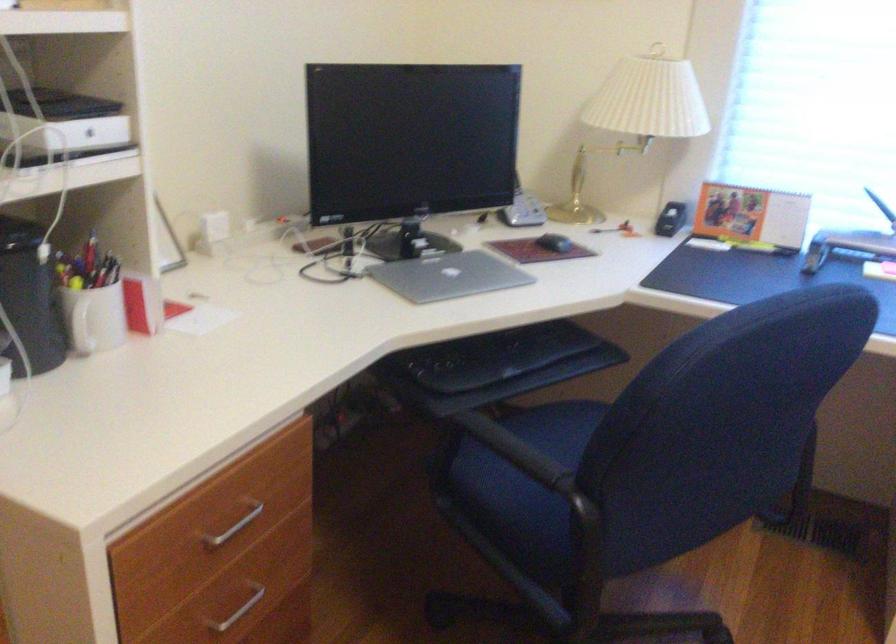
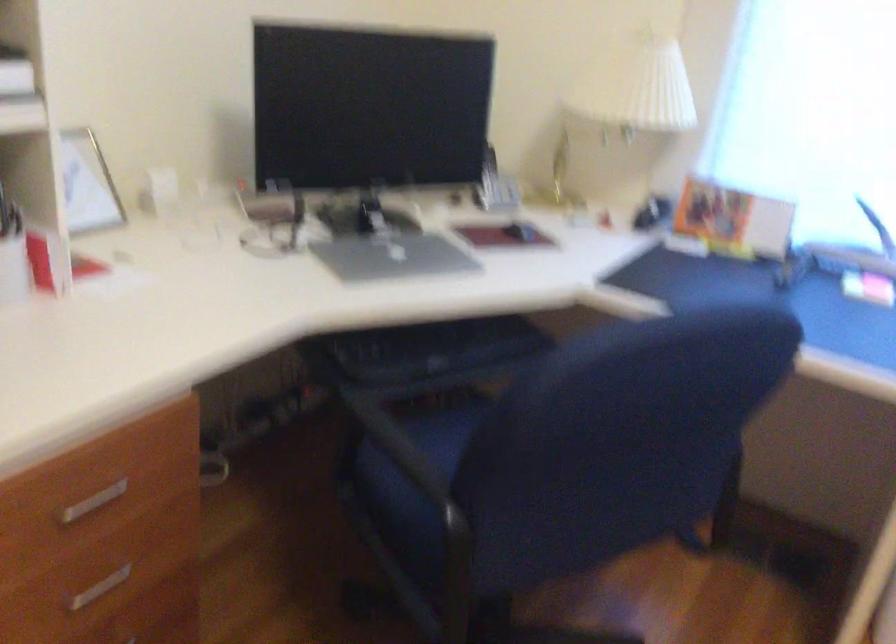
Question: Based on the continuous images, in which direction is the camera rotating? Reply with the corresponding letter.

Choices:
 (A) Left
 (B) Right
 (C) Up
 (D) Down

Answer: (D)